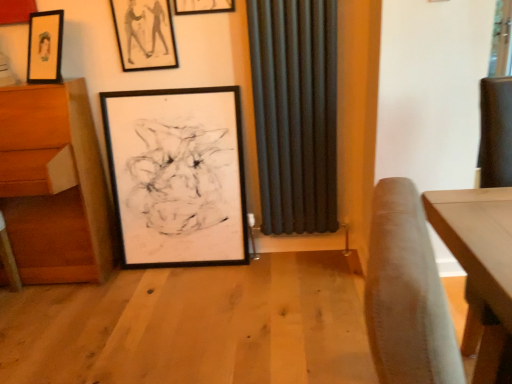
Question: Should I look upward or downward to see matte black picture frame at upper center, the second picture frame when ordered from bottom to top?

Choices:
 (A) up
 (B) down

Answer: (A)

Question: Would you say black matte picture frame at center, the 1th picture frame positioned from the bottom, contains wooden drawer at left?

Choices:
 (A) no
 (B) yes

Answer: (A)

Question: Is black matte picture frame at center, acting as the third picture frame starting from the top, wider than wooden drawer at left?

Choices:
 (A) no
 (B) yes

Answer: (A)

Question: Can you confirm if black matte picture frame at center, the 1th picture frame positioned from the bottom, is thinner than wooden drawer at left?

Choices:
 (A) no
 (B) yes

Answer: (B)

Question: Is black matte picture frame at center, acting as the third picture frame starting from the top, completely or partially outside of wooden drawer at left?

Choices:
 (A) no
 (B) yes

Answer: (B)

Question: From a real-world perspective, does black matte picture frame at center, acting as the third picture frame starting from the top, sit lower than wooden drawer at left?

Choices:
 (A) no
 (B) yes

Answer: (B)

Question: Is the surface of black matte picture frame at center, the 1th picture frame positioned from the bottom, in direct contact with wooden drawer at left?

Choices:
 (A) no
 (B) yes

Answer: (A)

Question: Is black matte picture frame at center, the 1th picture frame positioned from the bottom, shorter than matte black picture frame at upper center, which appears as the first picture frame when viewed from the top?

Choices:
 (A) no
 (B) yes

Answer: (A)

Question: Is black matte picture frame at center, the 1th picture frame positioned from the bottom, turned away from matte black picture frame at upper center, which is counted as the 3th picture frame, starting from the bottom?

Choices:
 (A) yes
 (B) no

Answer: (B)

Question: From a real-world perspective, does black matte picture frame at center, the 1th picture frame positioned from the bottom, sit lower than matte black picture frame at upper center, which is counted as the 3th picture frame, starting from the bottom?

Choices:
 (A) yes
 (B) no

Answer: (A)

Question: Is black matte picture frame at center, the 1th picture frame positioned from the bottom, in contact with matte black picture frame at upper center, which is counted as the 3th picture frame, starting from the bottom?

Choices:
 (A) no
 (B) yes

Answer: (A)

Question: Is the position of black matte picture frame at center, acting as the third picture frame starting from the top, more distant than that of matte black picture frame at upper center, which is counted as the 3th picture frame, starting from the bottom?

Choices:
 (A) no
 (B) yes

Answer: (B)

Question: Can you confirm if black matte picture frame at center, the 1th picture frame positioned from the bottom, is wider than matte black picture frame at upper center, which appears as the first picture frame when viewed from the top?

Choices:
 (A) yes
 (B) no

Answer: (A)

Question: Can you confirm if wooden drawer at left is wider than matte black picture frame at upper center, which is counted as the 3th picture frame, starting from the bottom?

Choices:
 (A) yes
 (B) no

Answer: (A)